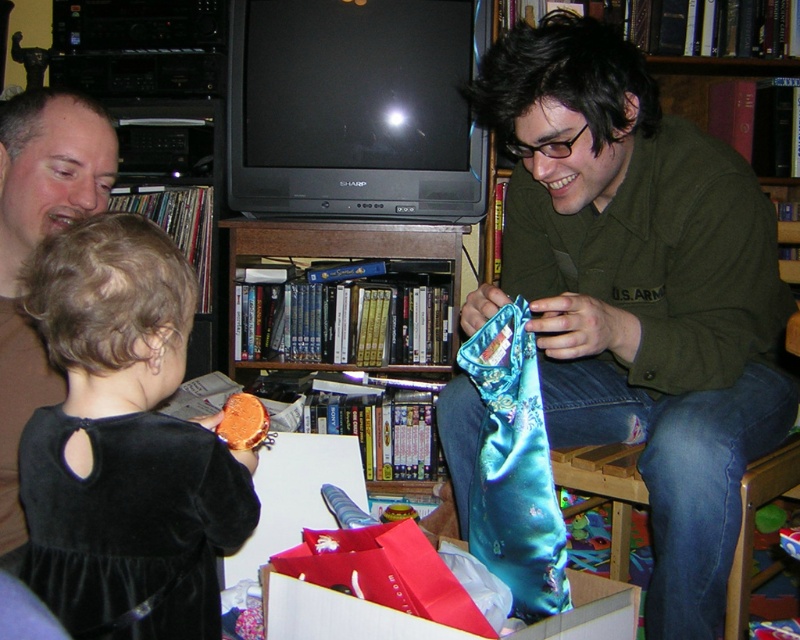
Who is positioned more to the right, shiny blue silk pouch at center or shiny wood bookshelf at center?

shiny blue silk pouch at center

Is point (725, 291) positioned after point (285, 248)?

No, (725, 291) is closer to viewer.

Is point (601, 74) in front of point (288, 224)?

Yes, point (601, 74) is in front of point (288, 224).

Identify the location of shiny blue silk pouch at center. (640, 291).

Which of these two, velvet black dress at left or teal satin tie at center, stands shorter?

Standing shorter between the two is teal satin tie at center.

Who is taller, velvet black dress at left or teal satin tie at center?

velvet black dress at left is taller.

Who is more distant from viewer, (x=162, y=260) or (x=526, y=556)?

The point (x=526, y=556) is more distant.

The width and height of the screenshot is (800, 640). Find the location of `velvet black dress at left`. velvet black dress at left is located at coordinates (124, 444).

Does brown velvet shirt at upper left have a greater width compared to shiny wood bookshelf at center?

In fact, brown velvet shirt at upper left might be narrower than shiny wood bookshelf at center.

Does brown velvet shirt at upper left have a lesser height compared to shiny wood bookshelf at center?

No.

Where is `brown velvet shirt at upper left`? brown velvet shirt at upper left is located at coordinates click(x=36, y=246).